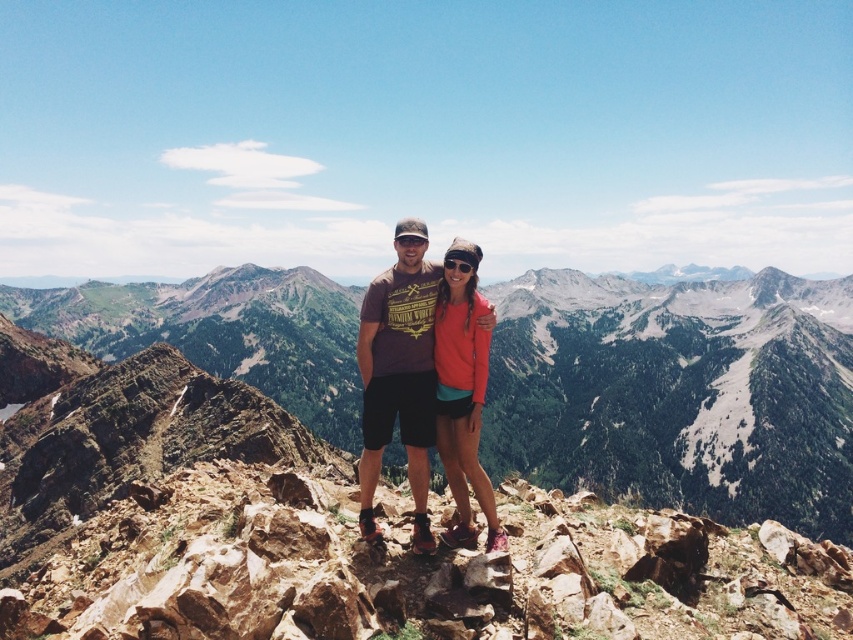
You are a photographer trying to capture the two points in the image. Which point is closer to the camera, point (602,403) or point (468,337)?

Point (468,337) is closer to the camera because the description states that point (602,403) is further to the viewer than point (468,337).

You are a hiker who wants to take a photo of the green grassy mountain at center. You are currently standing at point [677,392]. Is the green grassy mountain at center visible from your current position?

Answer: Yes, the green grassy mountain at center is located at point [677,392], so you are already at that position and can take the photo.